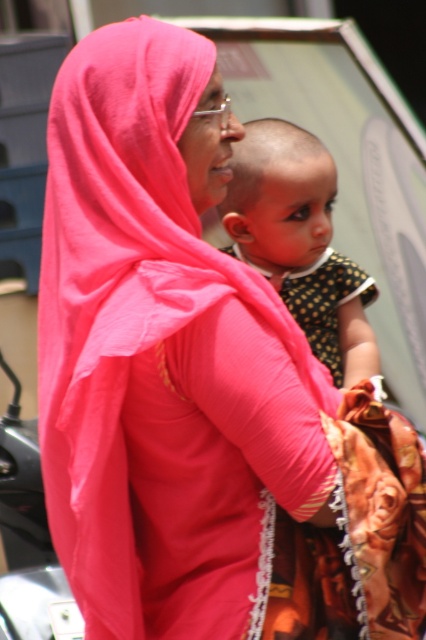
Does matte pink scarf at center have a lesser height compared to polka dot fabric baby at center?

No.

Locate an element on the screen. matte pink scarf at center is located at coordinates (161, 360).

You are a GUI agent. You are given a task and a screenshot of the screen. Output one action in this format:
    pyautogui.click(x=<x>, y=<y>)
    Task: Click on the matte pink scarf at center
    
    Given the screenshot: What is the action you would take?
    pyautogui.click(x=161, y=360)